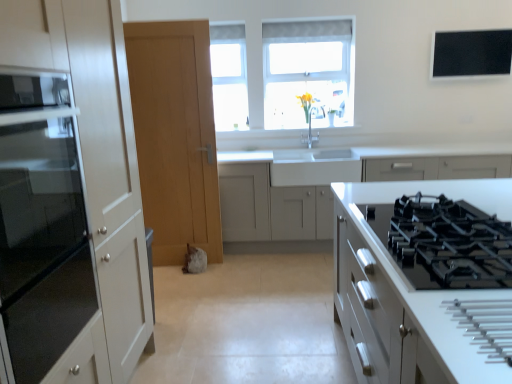
In the scene shown: In order to face white glossy stove at right, acting as the first cabinetry starting from the front, should I rotate leftwards or rightwards?

To face it directly, rotate right by 29.751 degrees.

What is the approximate height of black glass gas stove at center right?

The height of black glass gas stove at center right is 11.13 centimeters.

Find the location of `white glossy stove at right, positioned as the 3th cabinetry in back-to-front order`. white glossy stove at right, positioned as the 3th cabinetry in back-to-front order is located at coordinates (425, 279).

Is yellow matte vase at upper center not inside matte glass cabinet at left, positioned as the second cabinetry in front-to-back order?

yellow matte vase at upper center is positioned outside matte glass cabinet at left, positioned as the second cabinetry in front-to-back order.

Considering the sizes of objects yellow matte vase at upper center and matte glass cabinet at left, the second cabinetry in the back-to-front sequence, in the image provided, who is thinner, yellow matte vase at upper center or matte glass cabinet at left, the second cabinetry in the back-to-front sequence,?

Thinner between the two is yellow matte vase at upper center.

Is there a large distance between yellow matte vase at upper center and matte glass cabinet at left, the second cabinetry in the back-to-front sequence?

yellow matte vase at upper center is far away from matte glass cabinet at left, the second cabinetry in the back-to-front sequence.

From a real-world perspective, which object stands above the other?

From a 3D spatial view, light wood door at center is above.

Is white glossy stove at right, positioned as the 3th cabinetry in back-to-front order, completely or partially outside of light wood door at center?

Absolutely, white glossy stove at right, positioned as the 3th cabinetry in back-to-front order, is external to light wood door at center.

Can you confirm if white glossy stove at right, positioned as the 3th cabinetry in back-to-front order, is bigger than light wood door at center?

Correct, white glossy stove at right, positioned as the 3th cabinetry in back-to-front order, is larger in size than light wood door at center.

At what (x,y) coordinates should I click in order to perform the action: click on door that appears above the white glossy stove at right, acting as the first cabinetry starting from the front (from the image's perspective). Please return your answer as a coordinate pair (x, y). The width and height of the screenshot is (512, 384). Looking at the image, I should click on (175, 136).

Is white matte cabinet at center, which appears as the 1th cabinetry when viewed from the back, shorter than clear glass window at upper center?

In fact, white matte cabinet at center, which appears as the 1th cabinetry when viewed from the back, may be taller than clear glass window at upper center.

Between white matte cabinet at center, the 3th cabinetry when ordered from front to back, and clear glass window at upper center, which one has smaller width?

With smaller width is clear glass window at upper center.

From a real-world perspective, is white matte cabinet at center, which appears as the 1th cabinetry when viewed from the back, below clear glass window at upper center?

Indeed, from a real-world perspective, white matte cabinet at center, which appears as the 1th cabinetry when viewed from the back, is positioned beneath clear glass window at upper center.

Is white matte cabinet at center, which appears as the 1th cabinetry when viewed from the back, closer to the viewer compared to clear glass window at upper center?

Yes.

Which is in front, point (106, 222) or point (317, 163)?

The point (106, 222) is in front.

From the image's perspective, is matte glass cabinet at left, positioned as the second cabinetry in front-to-back order, located beneath white matte drawer at center?

A: Yes.

The image size is (512, 384). Find the location of `cabinetry on the left of white matte drawer at center`. cabinetry on the left of white matte drawer at center is located at coordinates (69, 198).

From a real-world perspective, relative to clear glass window at upper center, is black glass gas stove at center right vertically above or below?

From a real-world perspective, black glass gas stove at center right is physically below clear glass window at upper center.

Could clear glass window at upper center be considered to be inside black glass gas stove at center right?

No, clear glass window at upper center is not a part of black glass gas stove at center right.

Considering the sizes of objects clear glass window at upper center and white matte cabinet at center, the 3th cabinetry when ordered from front to back, in the image provided, who is wider, clear glass window at upper center or white matte cabinet at center, the 3th cabinetry when ordered from front to back,?

white matte cabinet at center, the 3th cabinetry when ordered from front to back.

Considering the sizes of clear glass window at upper center and white matte cabinet at center, the 3th cabinetry when ordered from front to back, in the image, is clear glass window at upper center bigger or smaller than white matte cabinet at center, the 3th cabinetry when ordered from front to back,?

In the image, clear glass window at upper center appears to be smaller than white matte cabinet at center, the 3th cabinetry when ordered from front to back.

Could you measure the distance between clear glass window at upper center and white matte cabinet at center, which appears as the 1th cabinetry when viewed from the back?

A distance of 1.05 meters exists between clear glass window at upper center and white matte cabinet at center, which appears as the 1th cabinetry when viewed from the back.

Considering the relative positions of clear glass window at upper center and white matte cabinet at center, which appears as the 1th cabinetry when viewed from the back, in the image provided, is clear glass window at upper center to the right of white matte cabinet at center, which appears as the 1th cabinetry when viewed from the back, from the viewer's perspective?

Incorrect, clear glass window at upper center is not on the right side of white matte cabinet at center, which appears as the 1th cabinetry when viewed from the back.

Can you tell me how much black matte window screen at upper right and matte glass cabinet at left, the second cabinetry in the back-to-front sequence, differ in facing direction?

Result: The facing directions of black matte window screen at upper right and matte glass cabinet at left, the second cabinetry in the back-to-front sequence, are 92.5 degrees apart.

Is black matte window screen at upper right positioned behind matte glass cabinet at left, the second cabinetry in the back-to-front sequence?

Yes, it is behind matte glass cabinet at left, the second cabinetry in the back-to-front sequence.

Could you measure the distance between black matte window screen at upper right and matte glass cabinet at left, positioned as the second cabinetry in front-to-back order?

They are 3.34 meters apart.

Is black matte window screen at upper right far away from matte glass cabinet at left, positioned as the second cabinetry in front-to-back order?

That's right, there is a large distance between black matte window screen at upper right and matte glass cabinet at left, positioned as the second cabinetry in front-to-back order.

Identify the location of flower above the matte glass cabinet at left, positioned as the second cabinetry in front-to-back order (from the image's perspective). The height and width of the screenshot is (384, 512). (306, 104).

You are a GUI agent. You are given a task and a screenshot of the screen. Output one action in this format:
    pyautogui.click(x=<x>, y=<y>)
    Task: Click on the door behind the white glossy stove at right, positioned as the 3th cabinetry in back-to-front order
    
    Given the screenshot: What is the action you would take?
    pyautogui.click(x=175, y=136)

Considering their positions, is matte glass cabinet at left, positioned as the second cabinetry in front-to-back order, positioned further to black matte window screen at upper right than black glass gas stove at center right?

matte glass cabinet at left, positioned as the second cabinetry in front-to-back order, is positioned further to the anchor black matte window screen at upper right.

From the image, which object appears to be farther from clear glass window at upper center, white matte drawer at center or yellow matte vase at upper center?

The object further to clear glass window at upper center is white matte drawer at center.

Considering their positions, is light wood door at center positioned closer to matte glass cabinet at left, the second cabinetry in the back-to-front sequence, than white matte drawer at center?

Among the two, light wood door at center is located nearer to matte glass cabinet at left, the second cabinetry in the back-to-front sequence.

From the image, which object appears to be nearer to yellow matte vase at upper center, black matte window screen at upper right or light wood door at center?

black matte window screen at upper right lies closer to yellow matte vase at upper center than the other object.

Which object lies nearer to the anchor point matte glass cabinet at left, positioned as the second cabinetry in front-to-back order, yellow matte vase at upper center or black glass gas stove at center right?

black glass gas stove at center right is positioned closer to the anchor matte glass cabinet at left, positioned as the second cabinetry in front-to-back order.

Considering their positions, is black glass gas stove at center right positioned closer to black matte window screen at upper right than light wood door at center?

Among the two, light wood door at center is located nearer to black matte window screen at upper right.

Based on their spatial positions, is black matte window screen at upper right or white glossy stove at right, acting as the first cabinetry starting from the front, closer to yellow matte vase at upper center?

The object closer to yellow matte vase at upper center is black matte window screen at upper right.

Based on the photo, from the image, which object appears to be farther from yellow matte vase at upper center, matte glass cabinet at left, positioned as the second cabinetry in front-to-back order, or light wood door at center?

The object further to yellow matte vase at upper center is matte glass cabinet at left, positioned as the second cabinetry in front-to-back order.

This screenshot has width=512, height=384. I want to click on flower situated between light wood door at center and white matte drawer at center from left to right, so click(306, 104).

At what (x,y) coordinates should I click in order to perform the action: click on drawer between light wood door at center and white matte cabinet at center, which appears as the 1th cabinetry when viewed from the back. Please return your answer as a coordinate pair (x, y). The image size is (512, 384). Looking at the image, I should click on (314, 171).

Where is `window screen between black glass gas stove at center right and clear glass window at upper center along the z-axis`? Image resolution: width=512 pixels, height=384 pixels. window screen between black glass gas stove at center right and clear glass window at upper center along the z-axis is located at coordinates (471, 54).

You are a GUI agent. You are given a task and a screenshot of the screen. Output one action in this format:
    pyautogui.click(x=<x>, y=<y>)
    Task: Click on the door positioned between matte glass cabinet at left, the second cabinetry in the back-to-front sequence, and white matte drawer at center from near to far
    The image size is (512, 384).
    Given the screenshot: What is the action you would take?
    pyautogui.click(x=175, y=136)